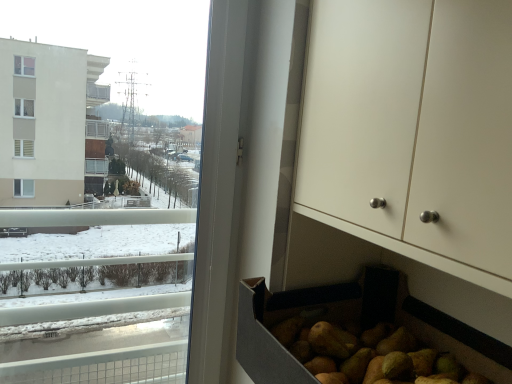
Question: Is transparent glass window at left smaller than white matte cabinet at lower right?

Choices:
 (A) yes
 (B) no

Answer: (A)

Question: From a real-world perspective, is transparent glass window at left under white matte cabinet at lower right?

Choices:
 (A) no
 (B) yes

Answer: (B)

Question: From a real-world perspective, is transparent glass window at left positioned over white matte cabinet at lower right based on gravity?

Choices:
 (A) no
 (B) yes

Answer: (A)

Question: Can you confirm if transparent glass window at left is shorter than white matte cabinet at lower right?

Choices:
 (A) no
 (B) yes

Answer: (A)

Question: Is transparent glass window at left aimed at white matte cabinet at lower right?

Choices:
 (A) yes
 (B) no

Answer: (B)

Question: Can you confirm if transparent glass window at left is bigger than white matte cabinet at lower right?

Choices:
 (A) no
 (B) yes

Answer: (A)

Question: From the image's perspective, is white matte cabinet at lower right located beneath transparent glass window at left?

Choices:
 (A) no
 (B) yes

Answer: (A)

Question: Does white matte cabinet at lower right have a greater width compared to transparent glass window at left?

Choices:
 (A) no
 (B) yes

Answer: (B)

Question: Is white matte cabinet at lower right thinner than transparent glass window at left?

Choices:
 (A) no
 (B) yes

Answer: (A)

Question: Is the depth of white matte cabinet at lower right greater than that of transparent glass window at left?

Choices:
 (A) no
 (B) yes

Answer: (A)

Question: Is transparent glass window at left surrounded by white matte cabinet at lower right?

Choices:
 (A) yes
 (B) no

Answer: (B)

Question: Can you confirm if white matte cabinet at lower right is shorter than transparent glass window at left?

Choices:
 (A) no
 (B) yes

Answer: (B)

Question: Is point (432, 26) positioned closer to the camera than point (2, 241)?

Choices:
 (A) farther
 (B) closer

Answer: (B)